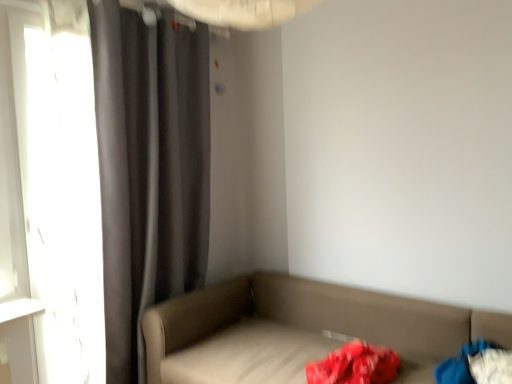
What is the approximate width of blue fabric bag at lower right?

It is 14.35 inches.

This screenshot has height=384, width=512. In order to click on transparent glass window at left in this screenshot , I will do `click(49, 202)`.

The width and height of the screenshot is (512, 384). In order to click on leatherette studio couch at lower right in this screenshot , I will do `click(300, 330)`.

Is leatherette studio couch at lower right aimed at dark gray fabric curtain at left?

No, leatherette studio couch at lower right is not turned towards dark gray fabric curtain at left.

Is leatherette studio couch at lower right in front of or behind dark gray fabric curtain at left in the image?

In the image, leatherette studio couch at lower right appears in front of dark gray fabric curtain at left.

Looking at this image, how many degrees apart are the facing directions of leatherette studio couch at lower right and dark gray fabric curtain at left?

The angular difference between leatherette studio couch at lower right and dark gray fabric curtain at left is 90.3 degrees.

Locate an element on the screen. This screenshot has width=512, height=384. studio couch below the dark gray fabric curtain at left (from a real-world perspective) is located at coordinates (300, 330).

From the image's perspective, relative to transparent glass window at left, is dark gray fabric curtain at left above or below?

Clearly, from the image's perspective, dark gray fabric curtain at left is above transparent glass window at left.

Is dark gray fabric curtain at left taller than transparent glass window at left?

Yes.

Which of these two, dark gray fabric curtain at left or transparent glass window at left, is thinner?

transparent glass window at left.

How different are the orientations of dark gray fabric curtain at left and transparent glass window at left in degrees?

The angular difference between dark gray fabric curtain at left and transparent glass window at left is 0.000903 degrees.

How different are the orientations of leatherette studio couch at lower right and transparent glass window at left in degrees?

They differ by 90.3 degrees in their facing directions.

Can you confirm if leatherette studio couch at lower right is taller than transparent glass window at left?

No.

Is point (155, 318) positioned before point (40, 296)?

No, (155, 318) is behind (40, 296).

Is leatherette studio couch at lower right located outside transparent glass window at left?

Yes.

Could you tell me if leatherette studio couch at lower right is turned towards blue fabric bag at lower right?

No, leatherette studio couch at lower right does not turn towards blue fabric bag at lower right.

Is point (502, 319) behind point (468, 377)?

Yes, it is behind point (468, 377).

Looking at this image, which object is closer to the camera, leatherette studio couch at lower right or blue fabric bag at lower right?

leatherette studio couch at lower right is more forward.

Is blue fabric bag at lower right looking in the opposite direction of dark gray fabric curtain at left?

blue fabric bag at lower right is not turned away from dark gray fabric curtain at left.

Which object is positioned more to the left, blue fabric bag at lower right or dark gray fabric curtain at left?

dark gray fabric curtain at left is more to the left.

From the picture: From a real-world perspective, which object rests below the other?

blue fabric bag at lower right is physically lower.

Are blue fabric bag at lower right and dark gray fabric curtain at left beside each other?

No, blue fabric bag at lower right is not touching dark gray fabric curtain at left.

Considering the sizes of objects transparent glass window at left and leatherette studio couch at lower right in the image provided, who is thinner, transparent glass window at left or leatherette studio couch at lower right?

transparent glass window at left.

From a real-world perspective, relative to leatherette studio couch at lower right, is transparent glass window at left vertically above or below?

In terms of real-world spatial position, transparent glass window at left is above leatherette studio couch at lower right.

Is blue fabric bag at lower right further to the viewer compared to leatherette studio couch at lower right?

That is True.

Which of these two, blue fabric bag at lower right or leatherette studio couch at lower right, stands taller?

leatherette studio couch at lower right.

Considering the sizes of objects blue fabric bag at lower right and leatherette studio couch at lower right in the image provided, who is thinner, blue fabric bag at lower right or leatherette studio couch at lower right?

Thinner between the two is blue fabric bag at lower right.

Where is `curtain that appears behind the leatherette studio couch at lower right`? The image size is (512, 384). curtain that appears behind the leatherette studio couch at lower right is located at coordinates pyautogui.click(x=149, y=169).

Where is `curtain that is on the right side of transparent glass window at left`? curtain that is on the right side of transparent glass window at left is located at coordinates (149, 169).

Estimate the real-world distances between objects in this image. Which object is further from transparent glass window at left, blue fabric bag at lower right or leatherette studio couch at lower right?

blue fabric bag at lower right lies further to transparent glass window at left than the other object.

Which object lies nearer to the anchor point leatherette studio couch at lower right, transparent glass window at left or blue fabric bag at lower right?

Based on the image, blue fabric bag at lower right appears to be nearer to leatherette studio couch at lower right.

From the image, which object appears to be farther from leatherette studio couch at lower right, blue fabric bag at lower right or dark gray fabric curtain at left?

Based on the image, dark gray fabric curtain at left appears to be further to leatherette studio couch at lower right.

When comparing their distances from leatherette studio couch at lower right, does dark gray fabric curtain at left or blue fabric bag at lower right seem further?

dark gray fabric curtain at left.

Looking at the image, which one is located closer to blue fabric bag at lower right, transparent glass window at left or leatherette studio couch at lower right?

Result: leatherette studio couch at lower right is positioned closer to the anchor blue fabric bag at lower right.

Considering their positions, is leatherette studio couch at lower right positioned closer to dark gray fabric curtain at left than transparent glass window at left?

transparent glass window at left lies closer to dark gray fabric curtain at left than the other object.

From the image, which object appears to be farther from blue fabric bag at lower right, leatherette studio couch at lower right or dark gray fabric curtain at left?

Among the two, dark gray fabric curtain at left is located further to blue fabric bag at lower right.

Looking at the image, which one is located closer to transparent glass window at left, leatherette studio couch at lower right or blue fabric bag at lower right?

leatherette studio couch at lower right is closer to transparent glass window at left.

The height and width of the screenshot is (384, 512). Find the location of `curtain between transparent glass window at left and leatherette studio couch at lower right`. curtain between transparent glass window at left and leatherette studio couch at lower right is located at coordinates (149, 169).

Where is `curtain located between transparent glass window at left and blue fabric bag at lower right in the left-right direction`? Image resolution: width=512 pixels, height=384 pixels. curtain located between transparent glass window at left and blue fabric bag at lower right in the left-right direction is located at coordinates (149, 169).

Where is `studio couch between dark gray fabric curtain at left and blue fabric bag at lower right from left to right`? studio couch between dark gray fabric curtain at left and blue fabric bag at lower right from left to right is located at coordinates (300, 330).

I want to click on studio couch between transparent glass window at left and blue fabric bag at lower right, so click(300, 330).